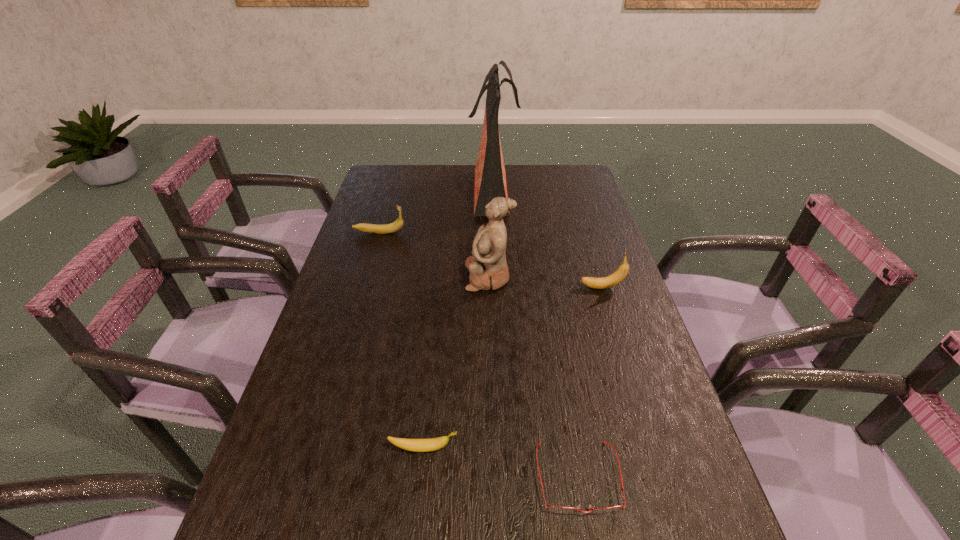
The width and height of the screenshot is (960, 540). I want to click on unoccupied area between the second nearest banana and the shopping bag, so coord(547,238).

You are a GUI agent. You are given a task and a screenshot of the screen. Output one action in this format:
    pyautogui.click(x=<x>, y=<y>)
    Task: Click on the empty location between the shortest object and the shortest banana
    The width and height of the screenshot is (960, 540).
    Given the screenshot: What is the action you would take?
    pyautogui.click(x=501, y=463)

This screenshot has width=960, height=540. Find the location of `vacant area that lies between the farthest object and the second shortest banana`. vacant area that lies between the farthest object and the second shortest banana is located at coordinates (436, 211).

Locate an element on the screen. This screenshot has width=960, height=540. vacant area between the farthest object and the fifth nearest object is located at coordinates (436, 211).

This screenshot has height=540, width=960. In order to click on vacant space in between the rightmost banana and the figurine in this screenshot , I will do `click(545, 282)`.

Find the location of a particular element. free space that is in between the figurine and the shortest object is located at coordinates (533, 377).

Locate an element on the screen. The height and width of the screenshot is (540, 960). vacant space that's between the figurine and the leftmost banana is located at coordinates (434, 254).

Image resolution: width=960 pixels, height=540 pixels. I want to click on free point between the rightmost banana and the shortest object, so click(589, 382).

This screenshot has height=540, width=960. I want to click on free spot between the shortest object and the tallest object, so click(x=536, y=333).

The width and height of the screenshot is (960, 540). What are the coordinates of `object that stands as the second closest to the tallest object` in the screenshot? It's located at (488, 269).